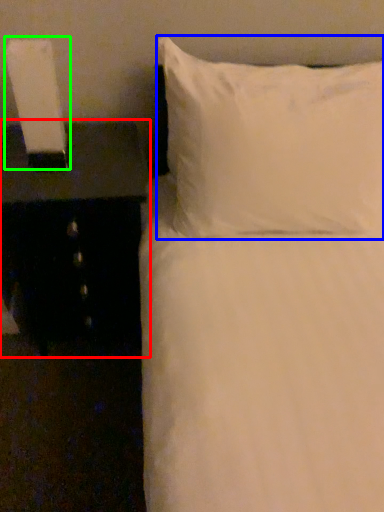
Question: Estimate the real-world distances between objects in this image. Which object is farther from nightstand (highlighted by a red box), pillow (highlighted by a blue box) or bedside lamp (highlighted by a green box)?

Choices:
 (A) pillow
 (B) bedside lamp

Answer: (A)